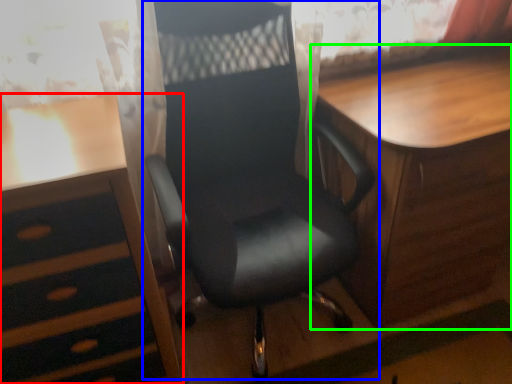
Question: Which object is positioned farthest from desk (highlighted by a red box)? Select from chair (highlighted by a blue box) and table (highlighted by a green box).

Choices:
 (A) chair
 (B) table

Answer: (B)